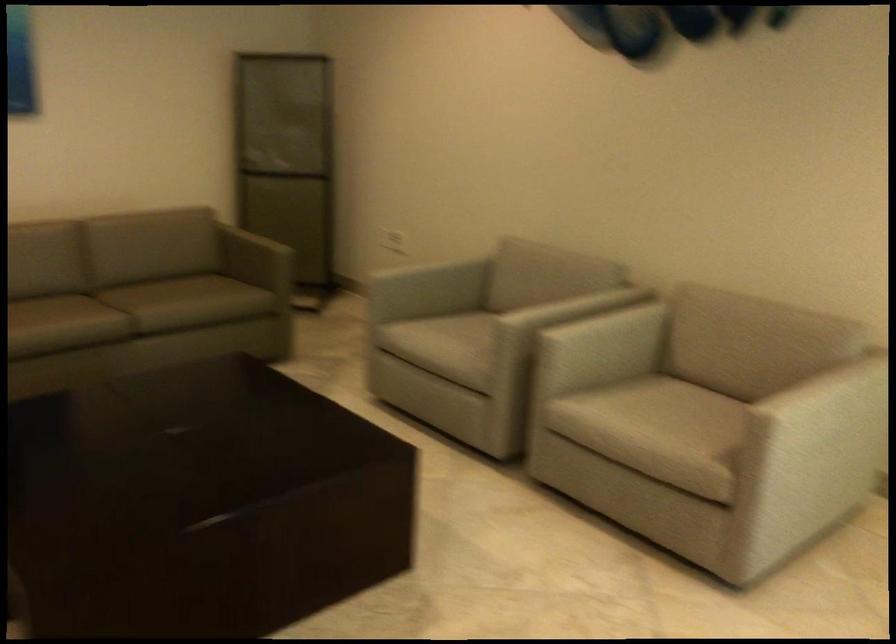
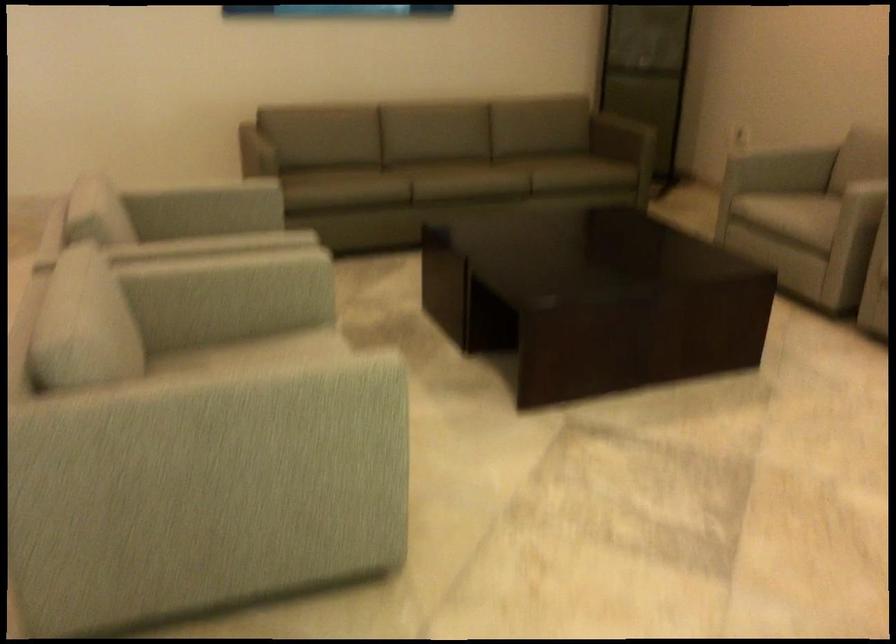
Question: In a continuous first-person perspective shot, in which direction is the camera moving?

Choices:
 (A) Left
 (B) Right
 (C) Forward
 (D) Backward

Answer: (D)